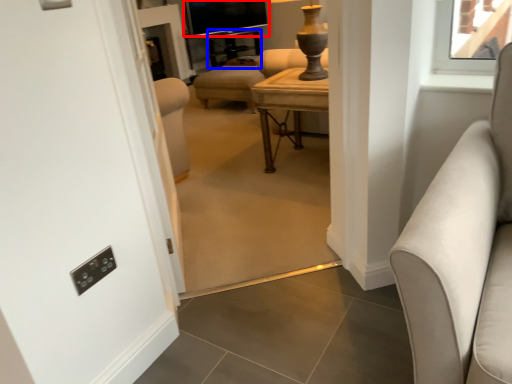
Question: Which object appears farthest to the camera in this image, window screen (highlighted by a red box) or side table (highlighted by a blue box)?

Choices:
 (A) window screen
 (B) side table

Answer: (A)